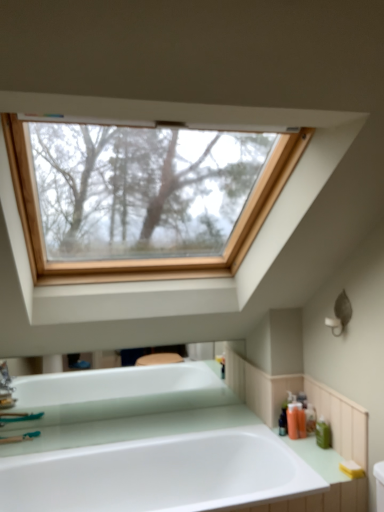
Question: From a real-world perspective, is translucent plastic soap dispenser at right, placed as the second toiletry when sorted from back to front, on top of translucent plastic soap dispenser at right, placed as the 4th toiletry when sorted from front to back?

Choices:
 (A) no
 (B) yes

Answer: (A)

Question: Is translucent plastic soap dispenser at right, marked as the 3th toiletry in a front-to-back arrangement, at the left side of translucent plastic soap dispenser at right, which is counted as the 1th toiletry, starting from the back?

Choices:
 (A) no
 (B) yes

Answer: (B)

Question: From a real-world perspective, is translucent plastic soap dispenser at right, placed as the second toiletry when sorted from back to front, under translucent plastic soap dispenser at right, which is counted as the 1th toiletry, starting from the back?

Choices:
 (A) no
 (B) yes

Answer: (B)

Question: Is translucent plastic soap dispenser at right, marked as the 3th toiletry in a front-to-back arrangement, facing towards translucent plastic soap dispenser at right, placed as the 4th toiletry when sorted from front to back?

Choices:
 (A) yes
 (B) no

Answer: (A)

Question: From the image's perspective, does translucent plastic soap dispenser at right, placed as the second toiletry when sorted from back to front, appear higher than translucent plastic soap dispenser at right, placed as the 4th toiletry when sorted from front to back?

Choices:
 (A) no
 (B) yes

Answer: (A)

Question: Is orange matte bottle at lower right, which is the 2th toiletry from front to back, in front of or behind translucent plastic soap dispenser at right, marked as the 3th toiletry in a front-to-back arrangement, in the image?

Choices:
 (A) front
 (B) behind

Answer: (A)

Question: Based on their sizes in the image, would you say orange matte bottle at lower right, which is the third toiletry in back-to-front order, is bigger or smaller than translucent plastic soap dispenser at right, placed as the second toiletry when sorted from back to front?

Choices:
 (A) big
 (B) small

Answer: (A)

Question: Would you say orange matte bottle at lower right, which is the 2th toiletry from front to back, is to the left or to the right of translucent plastic soap dispenser at right, placed as the second toiletry when sorted from back to front, in the picture?

Choices:
 (A) left
 (B) right

Answer: (A)

Question: From a real-world perspective, relative to translucent plastic soap dispenser at right, marked as the 3th toiletry in a front-to-back arrangement, is orange matte bottle at lower right, which is the third toiletry in back-to-front order, vertically above or below?

Choices:
 (A) above
 (B) below

Answer: (A)

Question: Based on their positions, is translucent plastic soap dispenser at right, placed as the second toiletry when sorted from back to front, located to the left or right of yellow sponge at lower right?

Choices:
 (A) right
 (B) left

Answer: (B)

Question: Is translucent plastic soap dispenser at right, marked as the 3th toiletry in a front-to-back arrangement, situated inside yellow sponge at lower right or outside?

Choices:
 (A) inside
 (B) outside

Answer: (B)

Question: Is translucent plastic soap dispenser at right, placed as the second toiletry when sorted from back to front, wider or thinner than yellow sponge at lower right?

Choices:
 (A) wide
 (B) thin

Answer: (B)

Question: Considering the positions of translucent plastic soap dispenser at right, marked as the 3th toiletry in a front-to-back arrangement, and yellow sponge at lower right in the image, is translucent plastic soap dispenser at right, marked as the 3th toiletry in a front-to-back arrangement, taller or shorter than yellow sponge at lower right?

Choices:
 (A) short
 (B) tall

Answer: (B)

Question: Is translucent plastic soap dispenser at right, marked as the 3th toiletry in a front-to-back arrangement, situated inside white glossy bathtub at center or outside?

Choices:
 (A) inside
 (B) outside

Answer: (B)

Question: Is point (296, 417) closer or farther from the camera than point (134, 399)?

Choices:
 (A) closer
 (B) farther

Answer: (A)